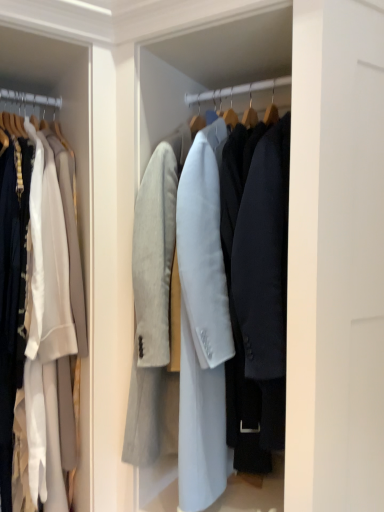
How much space does light gray wool coat at center, the second coat when ordered from left to right, occupy vertically?

The height of light gray wool coat at center, the second coat when ordered from left to right, is 1.31 meters.

This screenshot has height=512, width=384. What do you see at coordinates (200, 368) in the screenshot? I see `light gray wool coat at center, the second coat when ordered from left to right` at bounding box center [200, 368].

What are the coordinates of `light gray wool coat at center, the second coat when ordered from left to right` in the screenshot? It's located at [x=200, y=368].

Identify the location of white wool coat at left, placed as the second coat when sorted from right to left. (47, 320).

The height and width of the screenshot is (512, 384). What do you see at coordinates (47, 320) in the screenshot?
I see `white wool coat at left, the 1th coat viewed from the left` at bounding box center [47, 320].

Identify the location of light gray wool coat at center, the second coat when ordered from left to right. This screenshot has width=384, height=512. (200, 368).

Considering the positions of objects white wool coat at left, placed as the second coat when sorted from right to left, and light gray wool coat at center, the second coat when ordered from left to right, in the image provided, who is more to the left, white wool coat at left, placed as the second coat when sorted from right to left, or light gray wool coat at center, the second coat when ordered from left to right,?

Positioned to the left is white wool coat at left, placed as the second coat when sorted from right to left.

Is white wool coat at left, placed as the second coat when sorted from right to left, closer to the viewer compared to light gray wool coat at center, the 1th coat positioned from the right?

No, white wool coat at left, placed as the second coat when sorted from right to left, is further to the viewer.

Which is behind, point (42, 147) or point (164, 393)?

The point (164, 393) is more distant.

From the image's perspective, is white wool coat at left, placed as the second coat when sorted from right to left, beneath light gray wool coat at center, the second coat when ordered from left to right?

Indeed, from the image's perspective, white wool coat at left, placed as the second coat when sorted from right to left, is shown beneath light gray wool coat at center, the second coat when ordered from left to right.

From a real-world perspective, is white wool coat at left, the 1th coat viewed from the left, physically below light gray wool coat at center, the second coat when ordered from left to right?

Correct, in the physical world, white wool coat at left, the 1th coat viewed from the left, is lower than light gray wool coat at center, the second coat when ordered from left to right.

Considering the sizes of white wool coat at left, the 1th coat viewed from the left, and light gray wool coat at center, the second coat when ordered from left to right, in the image, is white wool coat at left, the 1th coat viewed from the left, wider or thinner than light gray wool coat at center, the second coat when ordered from left to right,?

white wool coat at left, the 1th coat viewed from the left, is thinner than light gray wool coat at center, the second coat when ordered from left to right.

Does white wool coat at left, the 1th coat viewed from the left, have a lesser height compared to light gray wool coat at center, the 1th coat positioned from the right?

No, white wool coat at left, the 1th coat viewed from the left, is not shorter than light gray wool coat at center, the 1th coat positioned from the right.

Is white wool coat at left, placed as the second coat when sorted from right to left, bigger or smaller than light gray wool coat at center, the 1th coat positioned from the right?

Clearly, white wool coat at left, placed as the second coat when sorted from right to left, is smaller in size than light gray wool coat at center, the 1th coat positioned from the right.

Is light gray wool coat at center, the second coat when ordered from left to right, surrounded by white wool coat at left, placed as the second coat when sorted from right to left?

No, light gray wool coat at center, the second coat when ordered from left to right, is not a part of white wool coat at left, placed as the second coat when sorted from right to left.

Is white wool coat at left, the 1th coat viewed from the left, positioned far away from light gray wool coat at center, the second coat when ordered from left to right?

No, white wool coat at left, the 1th coat viewed from the left, is in close proximity to light gray wool coat at center, the second coat when ordered from left to right.

Does white wool coat at left, placed as the second coat when sorted from right to left, turn towards light gray wool coat at center, the second coat when ordered from left to right?

No, white wool coat at left, placed as the second coat when sorted from right to left, is not aimed at light gray wool coat at center, the second coat when ordered from left to right.

What's the angular difference between white wool coat at left, placed as the second coat when sorted from right to left, and light gray wool coat at center, the second coat when ordered from left to right,'s facing directions?

The facing directions of white wool coat at left, placed as the second coat when sorted from right to left, and light gray wool coat at center, the second coat when ordered from left to right, are 62.1 degrees apart.

Find the location of a particular element. Image resolution: width=384 pixels, height=512 pixels. coat in front of the white wool coat at left, the 1th coat viewed from the left is located at coordinates (200, 368).

Considering the relative positions of light gray wool coat at center, the 1th coat positioned from the right, and white wool coat at left, the 1th coat viewed from the left, in the image provided, is light gray wool coat at center, the 1th coat positioned from the right, to the left or to the right of white wool coat at left, the 1th coat viewed from the left,?

In the image, light gray wool coat at center, the 1th coat positioned from the right, appears on the right side of white wool coat at left, the 1th coat viewed from the left.

Is the depth of light gray wool coat at center, the second coat when ordered from left to right, less than that of white wool coat at left, the 1th coat viewed from the left?

Yes, it is in front of white wool coat at left, the 1th coat viewed from the left.

Is point (251, 438) farther from viewer compared to point (69, 353)?

No, it is in front of (69, 353).

From the image's perspective, would you say light gray wool coat at center, the second coat when ordered from left to right, is positioned over white wool coat at left, placed as the second coat when sorted from right to left?

Yes, from the image's perspective, light gray wool coat at center, the second coat when ordered from left to right, is above white wool coat at left, placed as the second coat when sorted from right to left.

From a real-world perspective, is light gray wool coat at center, the 1th coat positioned from the right, physically located above or below white wool coat at left, the 1th coat viewed from the left?

Clearly, from a real-world perspective, light gray wool coat at center, the 1th coat positioned from the right, is above white wool coat at left, the 1th coat viewed from the left.

Does light gray wool coat at center, the 1th coat positioned from the right, have a lesser width compared to white wool coat at left, the 1th coat viewed from the left?

No, light gray wool coat at center, the 1th coat positioned from the right, is not thinner than white wool coat at left, the 1th coat viewed from the left.

Is light gray wool coat at center, the second coat when ordered from left to right, taller than white wool coat at left, placed as the second coat when sorted from right to left?

In fact, light gray wool coat at center, the second coat when ordered from left to right, may be shorter than white wool coat at left, placed as the second coat when sorted from right to left.

Which of these two, light gray wool coat at center, the 1th coat positioned from the right, or white wool coat at left, the 1th coat viewed from the left, is bigger?

Bigger between the two is light gray wool coat at center, the 1th coat positioned from the right.

Is light gray wool coat at center, the second coat when ordered from left to right, positioned beyond the bounds of white wool coat at left, placed as the second coat when sorted from right to left?

That's correct, light gray wool coat at center, the second coat when ordered from left to right, is outside of white wool coat at left, placed as the second coat when sorted from right to left.

Is light gray wool coat at center, the second coat when ordered from left to right, not near white wool coat at left, placed as the second coat when sorted from right to left?

No, light gray wool coat at center, the second coat when ordered from left to right, is not far from white wool coat at left, placed as the second coat when sorted from right to left.

Looking at this image, is light gray wool coat at center, the 1th coat positioned from the right, positioned with its back to white wool coat at left, the 1th coat viewed from the left?

light gray wool coat at center, the 1th coat positioned from the right, does not have its back to white wool coat at left, the 1th coat viewed from the left.

This screenshot has height=512, width=384. In order to click on coat that appears above the white wool coat at left, the 1th coat viewed from the left (from a real-world perspective) in this screenshot , I will do `click(200, 368)`.

The image size is (384, 512). I want to click on coat behind the light gray wool coat at center, the 1th coat positioned from the right, so click(47, 320).

Find the location of `coat to the left of light gray wool coat at center, the second coat when ordered from left to right`. coat to the left of light gray wool coat at center, the second coat when ordered from left to right is located at coordinates (47, 320).